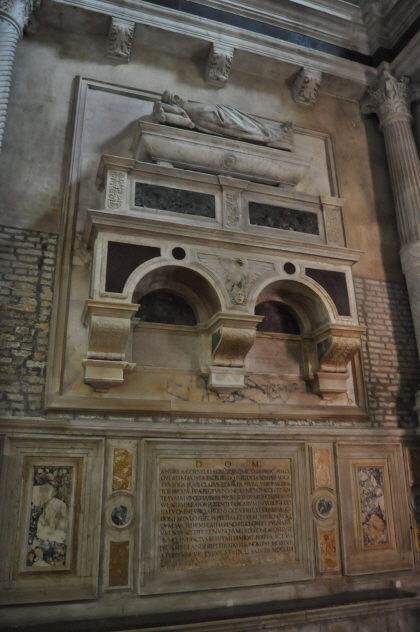
Locate an element on the screen. bed is located at coordinates (218, 155).